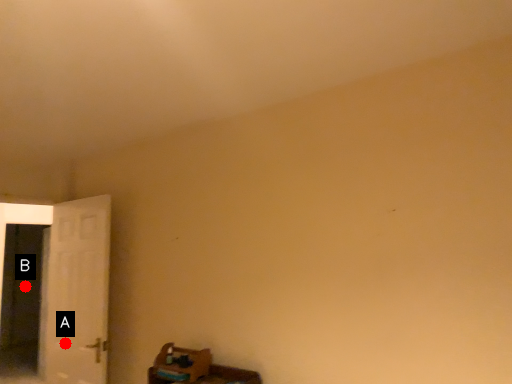
Question: Two points are circled on the image, labeled by A and B beside each circle. Which point is further to the camera?

Choices:
 (A) A is further
 (B) B is further

Answer: (B)